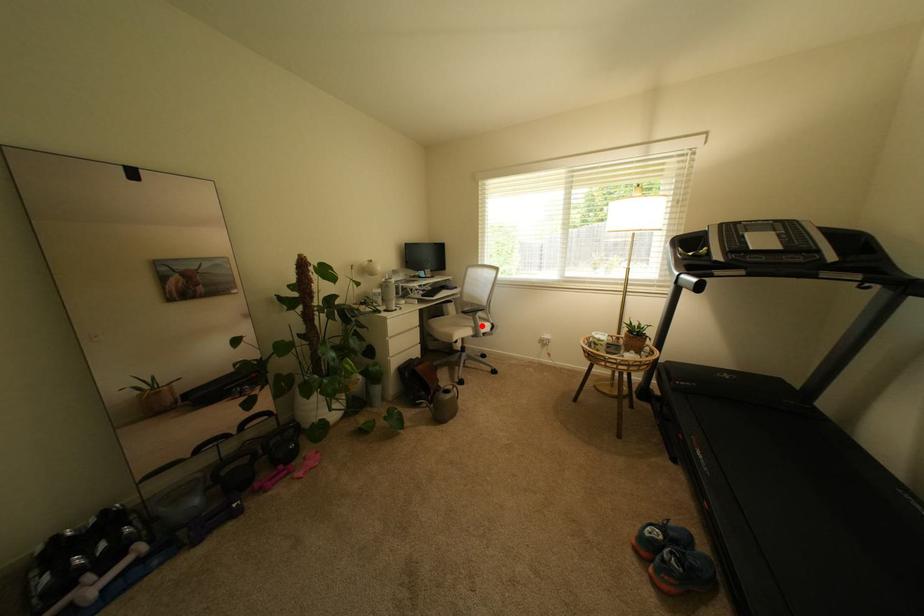
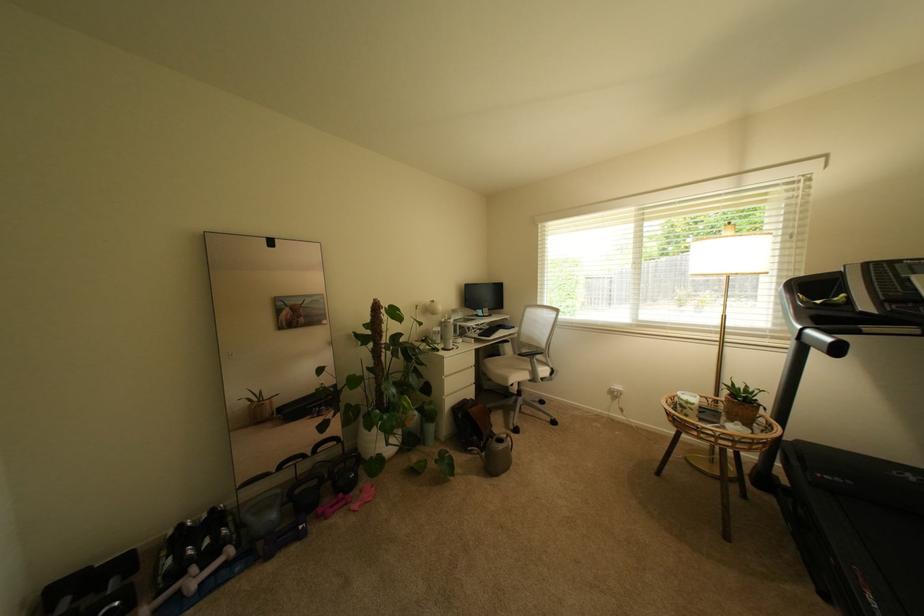
Where in the second image is the point corresponding to the highlighted location from the first image?

(540, 370)